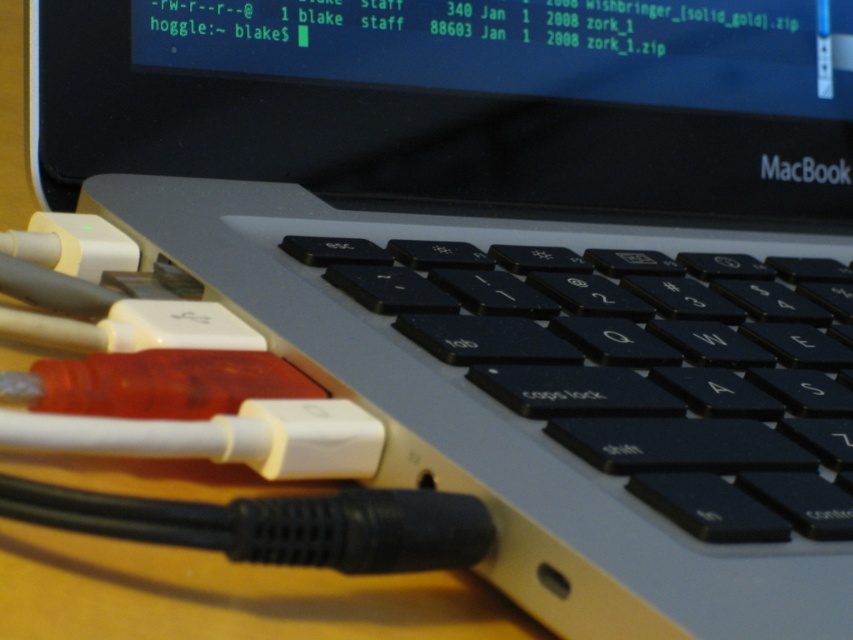
You need to place a protective cover over both the black glossy screen at upper center and the black matte keyboard at center. Which object requires a larger cover?

The black glossy screen at upper center requires a larger cover because it is bigger than the black matte keyboard at center.

Based on the photo, you are a photographer aiming to capture a clear shot of the black glossy screen at upper center without any glare. The camera you are using has a fixed position and cannot move closer than 22 inches. Can you take the photo as planned?

The black glossy screen at upper center and camera are 22.27 inches apart from each other. Since the minimum distance your camera can move is 22 inches, you can position the camera at exactly 22.27 inches away to capture the shot without violating the distance constraint.

You are a technician trying to locate the black glossy screen at upper center on the MacBook. According to the coordinates provided, where exactly should you look on the MacBook?

The black glossy screen at upper center is located at point (462, 104).